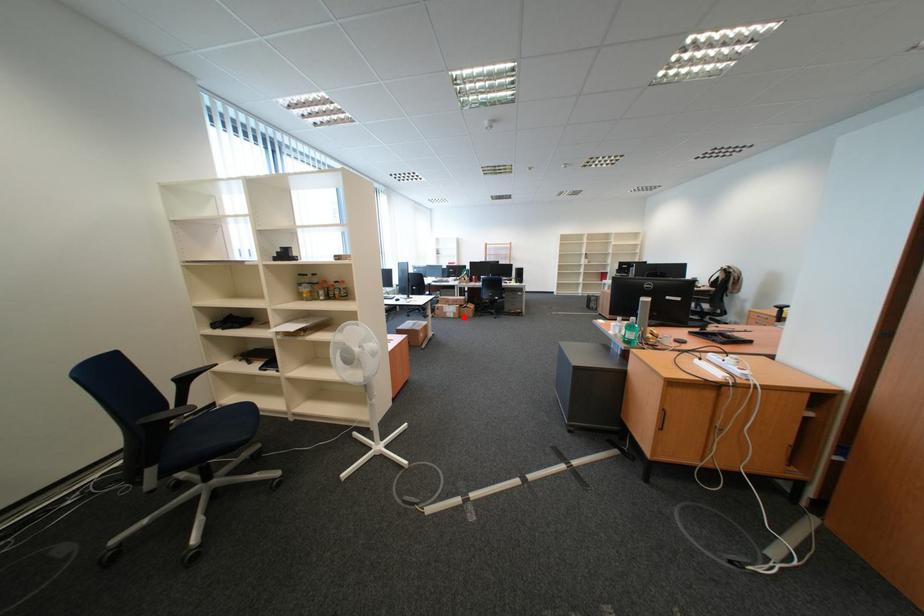
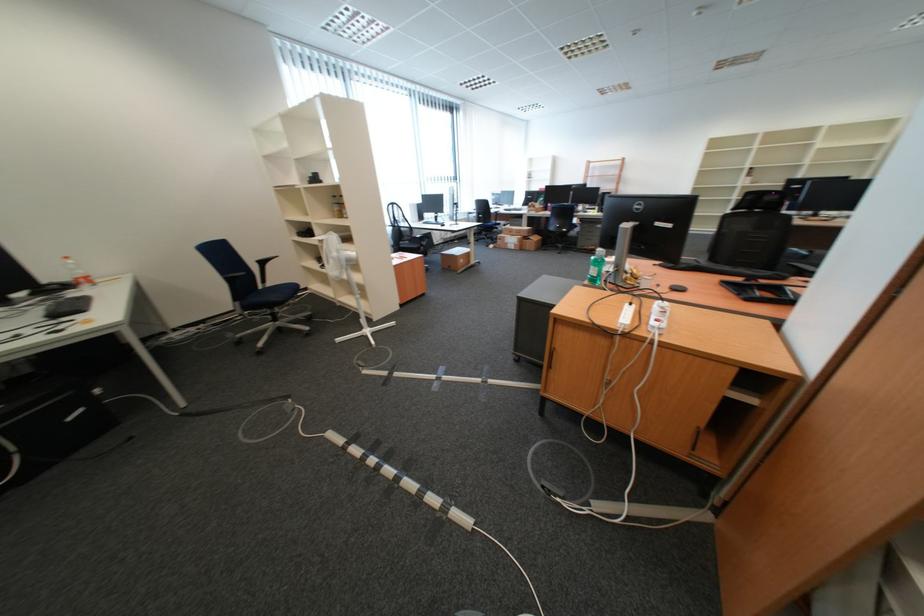
Question: I am providing you with two images of the same scene from different viewpoints. A red point is shown in image1. For the corresponding object point in image2, is it positioned nearer or farther from the camera?

Choices:
 (A) Nearer
 (B) Farther

Answer: (A)